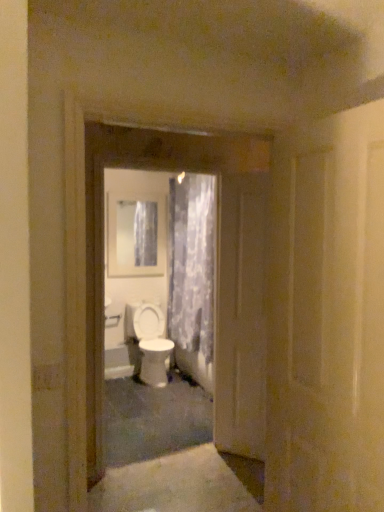
Question: From the image's perspective, is white glossy door at center, positioned as the 3th door in front-to-back order, above white glossy toilet at center?

Choices:
 (A) yes
 (B) no

Answer: (A)

Question: From the image's perspective, does white glossy door at center, which is the first door in back-to-front order, appear lower than white glossy toilet at center?

Choices:
 (A) no
 (B) yes

Answer: (A)

Question: Is white glossy toilet at center inside white glossy door at center, which is the first door in back-to-front order?

Choices:
 (A) yes
 (B) no

Answer: (B)

Question: Is white glossy door at center, which is the first door in back-to-front order, far away from white glossy toilet at center?

Choices:
 (A) no
 (B) yes

Answer: (B)

Question: Considering the relative positions of white glossy door at center, which is the first door in back-to-front order, and white glossy toilet at center in the image provided, is white glossy door at center, which is the first door in back-to-front order, in front of white glossy toilet at center?

Choices:
 (A) yes
 (B) no

Answer: (A)

Question: Can you confirm if white glossy door at center, which is the first door in back-to-front order, is wider than white glossy toilet at center?

Choices:
 (A) yes
 (B) no

Answer: (B)

Question: Can you confirm if translucent floral fabric at center is positioned to the right of white glossy toilet at center?

Choices:
 (A) yes
 (B) no

Answer: (A)

Question: From the image's perspective, is translucent floral fabric at center below white glossy toilet at center?

Choices:
 (A) yes
 (B) no

Answer: (B)

Question: Is translucent floral fabric at center turned away from white glossy toilet at center?

Choices:
 (A) no
 (B) yes

Answer: (A)

Question: From the image's perspective, is translucent floral fabric at center above white glossy toilet at center?

Choices:
 (A) no
 (B) yes

Answer: (B)

Question: Does translucent floral fabric at center have a greater width compared to white glossy toilet at center?

Choices:
 (A) yes
 (B) no

Answer: (B)

Question: Is translucent floral fabric at center facing towards white glossy toilet at center?

Choices:
 (A) no
 (B) yes

Answer: (B)

Question: Considering the relative sizes of white glossy door at center, placed as the first door when sorted from front to back, and white glossy door at center, arranged as the second door when viewed from the back, in the image provided, is white glossy door at center, placed as the first door when sorted from front to back, shorter than white glossy door at center, arranged as the second door when viewed from the back,?

Choices:
 (A) yes
 (B) no

Answer: (A)